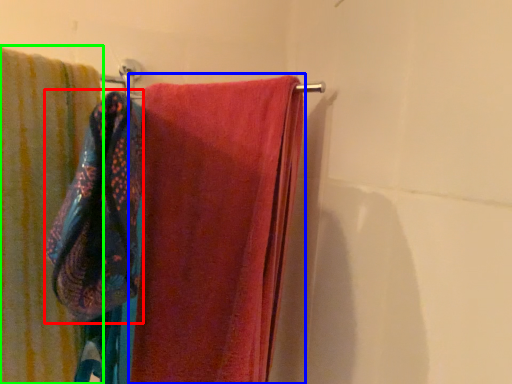
Question: Considering the real-world distances, which object is farthest from beach towel (highlighted by a red box)? towel (highlighted by a blue box) or towel (highlighted by a green box)?

Choices:
 (A) towel
 (B) towel

Answer: (A)